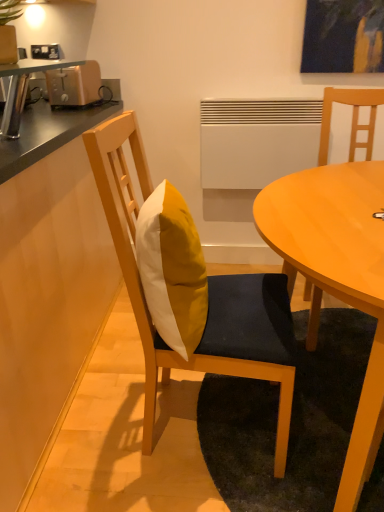
Image resolution: width=384 pixels, height=512 pixels. Identify the location of vacant space to the left of yellow fabric cushion at center, marked as the second chair in a right-to-left arrangement. (97, 416).